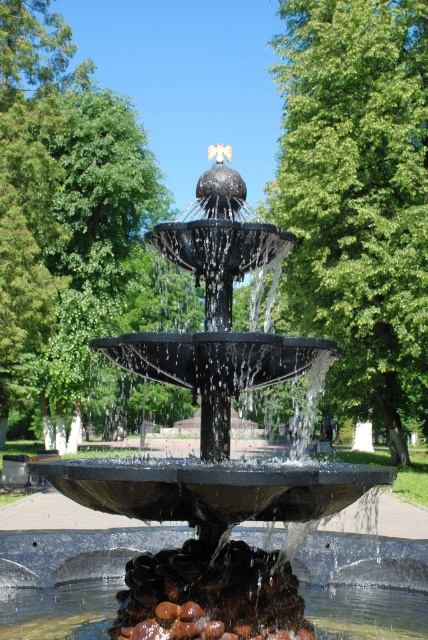
You are standing in the park and see the fountain with two green leafy trees. One is labeled as the green leafy tree at center and the other as the green leafy tree at upper center. Which tree is positioned higher in the image?

The green leafy tree at center is located above the green leafy tree at upper center, so the green leafy tree at center is positioned higher in the image.

You are standing in front of the fountain and want to take a photo that includes both the green leafy tree at center and the green leafy tree at upper center. Which tree should you position closer to the camera to ensure both are in focus?

To ensure both the green leafy tree at center and the green leafy tree at upper center are in focus, position the green leafy tree at center closer to the camera since it is nearer to you than the green leafy tree at upper center, which is farther away.

You are standing in the park and see the green leafy tree at center and the green leafy tree at upper center. Which tree is wider?

The green leafy tree at upper center is wider than the green leafy tree at center.